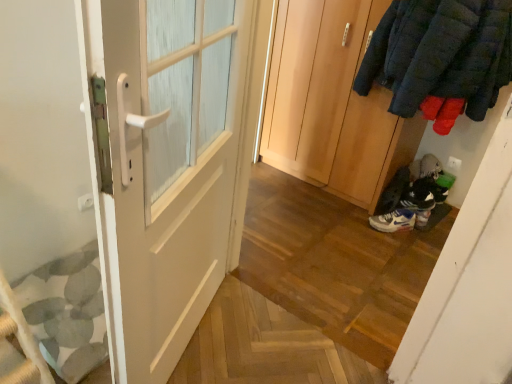
Question: Is white leather sneakers at lower right, which appears as the second footwear when viewed from the left, taller than white matte door at left, which is the 1th door in left-to-right order?

Choices:
 (A) yes
 (B) no

Answer: (B)

Question: From the image's perspective, is white leather sneakers at lower right, which appears as the second footwear when viewed from the left, located above white matte door at left, which is the 1th door in left-to-right order?

Choices:
 (A) no
 (B) yes

Answer: (B)

Question: Does white leather sneakers at lower right, which is the 1th footwear in right-to-left order, have a lesser height compared to white matte door at left, which is the first door in front-to-back order?

Choices:
 (A) no
 (B) yes

Answer: (B)

Question: Could you tell me if white leather sneakers at lower right, which is the 1th footwear in right-to-left order, is turned towards white matte door at left, which is counted as the 2th door, starting from the right?

Choices:
 (A) yes
 (B) no

Answer: (A)

Question: From a real-world perspective, is white leather sneakers at lower right, which appears as the second footwear when viewed from the left, physically below white matte door at left, which is the 1th door in left-to-right order?

Choices:
 (A) no
 (B) yes

Answer: (B)

Question: Is white leather sneakers at lower right, which appears as the second footwear when viewed from the left, placed right next to white matte door at left, which ranks as the second door in back-to-front order?

Choices:
 (A) yes
 (B) no

Answer: (B)

Question: Are white leather sneakers at lower right, which is the 1th footwear in right-to-left order, and wooden wardrobe at center, the second door viewed from the front, beside each other?

Choices:
 (A) yes
 (B) no

Answer: (B)

Question: Is white leather sneakers at lower right, which appears as the second footwear when viewed from the left, in front of wooden wardrobe at center, the 1th door when ordered from right to left?

Choices:
 (A) no
 (B) yes

Answer: (A)

Question: Can you confirm if white leather sneakers at lower right, which appears as the second footwear when viewed from the left, is thinner than wooden wardrobe at center, arranged as the first door when viewed from the back?

Choices:
 (A) no
 (B) yes

Answer: (B)

Question: Can you confirm if white leather sneakers at lower right, which appears as the second footwear when viewed from the left, is smaller than wooden wardrobe at center, arranged as the first door when viewed from the back?

Choices:
 (A) no
 (B) yes

Answer: (B)

Question: Does white leather sneakers at lower right, which is the 1th footwear in right-to-left order, turn towards wooden wardrobe at center, the second door viewed from the front?

Choices:
 (A) yes
 (B) no

Answer: (B)

Question: Considering the relative sizes of white leather sneakers at lower right, which appears as the second footwear when viewed from the left, and wooden wardrobe at center, the second door when ordered from left to right, in the image provided, is white leather sneakers at lower right, which appears as the second footwear when viewed from the left, taller than wooden wardrobe at center, the second door when ordered from left to right,?

Choices:
 (A) yes
 (B) no

Answer: (B)

Question: Can you confirm if wooden wardrobe at center, the 1th door when ordered from right to left, is shorter than white matte sneaker at lower right, positioned as the 2th footwear in right-to-left order?

Choices:
 (A) yes
 (B) no

Answer: (B)